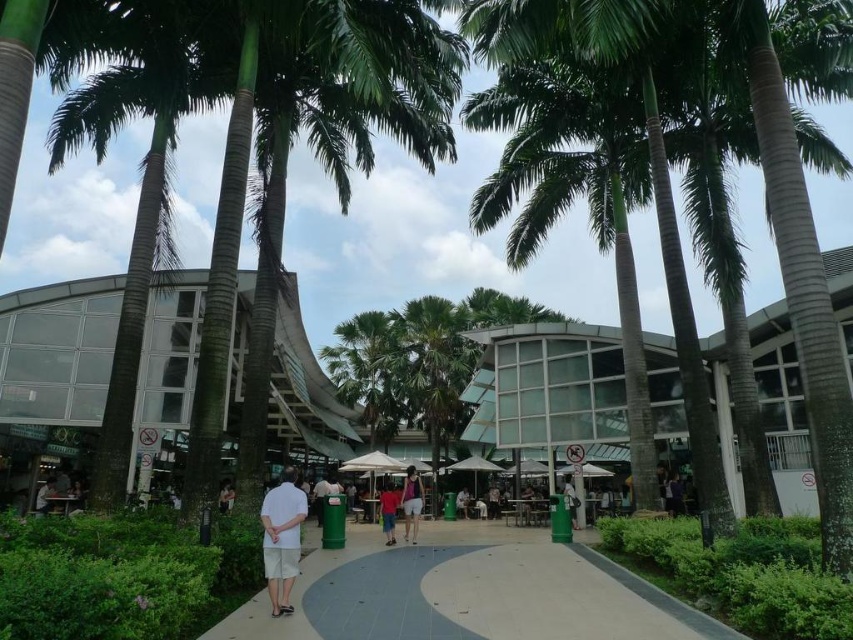
Question: Can you confirm if gray concrete pavement at center is bigger than matte pink shorts at center?

Choices:
 (A) yes
 (B) no

Answer: (B)

Question: Is matte pink shorts at center smaller than white cotton shorts at center?

Choices:
 (A) no
 (B) yes

Answer: (A)

Question: Which object appears closest to the camera in this image?

Choices:
 (A) matte pink shorts at center
 (B) white cotton shorts at center
 (C) bright orange shirt at center
 (D) gray concrete pavement at center

Answer: (D)

Question: Is white cotton shirt at center below white cotton shorts at center?

Choices:
 (A) no
 (B) yes

Answer: (A)

Question: Which point is farther to the camera?

Choices:
 (A) 413,470
 (B) 390,522
 (C) 393,532

Answer: (A)

Question: Which object is the closest to the bright orange shirt at center?

Choices:
 (A) gray concrete pavement at center
 (B) matte pink shorts at center

Answer: (B)